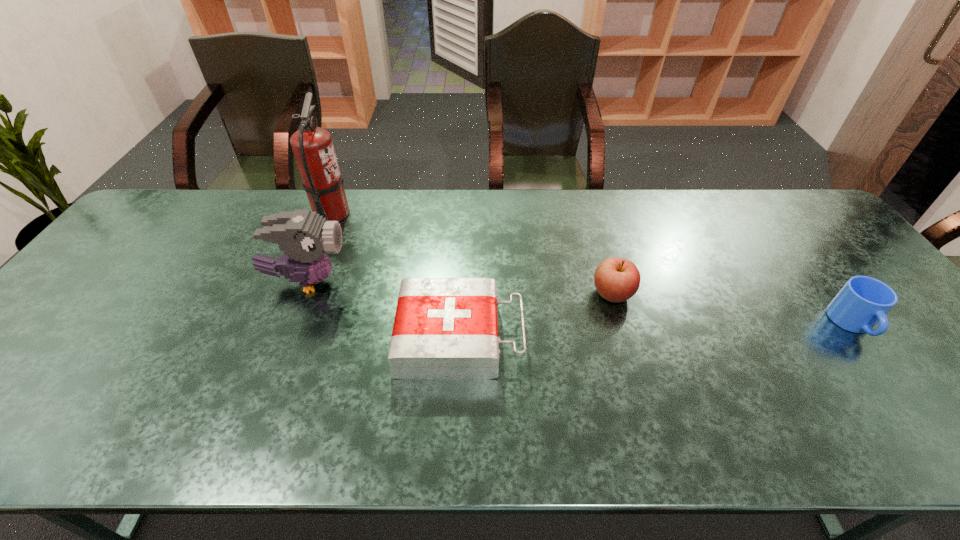
Locate an element on the screen. vacant space located 0.130m on the side of the rightmost object with the handle is located at coordinates (907, 395).

At what (x,y) coordinates should I click in order to perform the action: click on vacant point located on the front side of the first-aid kit. Please return your answer as a coordinate pair (x, y). The height and width of the screenshot is (540, 960). Looking at the image, I should click on (600, 337).

Locate an element on the screen. object located at the far edge is located at coordinates (312, 146).

Find the location of `object at the right edge`. object at the right edge is located at coordinates point(863,301).

This screenshot has height=540, width=960. I want to click on vacant space at the far edge of the desktop, so click(x=617, y=230).

Where is `blank area at the near edge`? The height and width of the screenshot is (540, 960). blank area at the near edge is located at coordinates (207, 438).

Where is `vacant space at the far left corner of the desktop`? vacant space at the far left corner of the desktop is located at coordinates (180, 202).

The image size is (960, 540). Identify the location of vacant area at the far right corner. (762, 190).

The width and height of the screenshot is (960, 540). What are the coordinates of `empty space that is in between the rightmost object and the fourth object from left to right` in the screenshot? It's located at (732, 309).

What are the coordinates of `empty space between the mug and the fire extinguisher` in the screenshot? It's located at pyautogui.click(x=592, y=269).